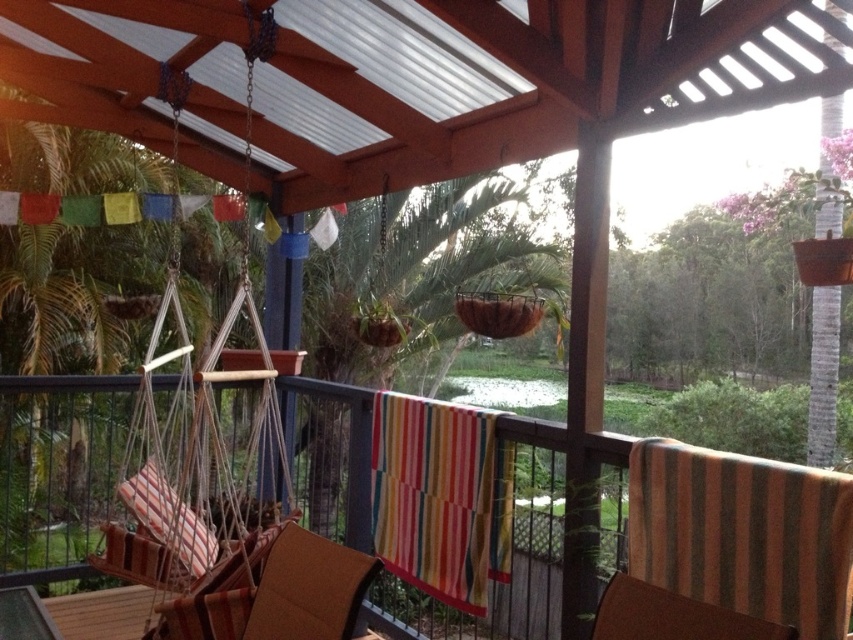
The height and width of the screenshot is (640, 853). Find the location of `striped fabric cushion at center`. striped fabric cushion at center is located at coordinates (650, 538).

Does point (653, 490) lie in front of point (213, 589)?

That is True.

What are the coordinates of `striped fabric cushion at center` in the screenshot? It's located at (650, 538).

Is striped fabric cushion at center closer to the viewer compared to striped fabric towel at center?

Yes, striped fabric cushion at center is closer to the viewer.

Where is `striped fabric cushion at center`? striped fabric cushion at center is located at coordinates (650, 538).

Between striped fabric swing at left and brown striped fabric chair at center, which one has more height?

striped fabric swing at left

Is striped fabric swing at left bigger than brown striped fabric chair at center?

Correct, striped fabric swing at left is larger in size than brown striped fabric chair at center.

From the picture: Who is more distant from viewer, (213,584) or (845,589)?

Point (213,584)

You are a GUI agent. You are given a task and a screenshot of the screen. Output one action in this format:
    pyautogui.click(x=<x>, y=<y>)
    Task: Click on the striped fabric swing at left
    
    Given the screenshot: What is the action you would take?
    pyautogui.click(x=201, y=458)